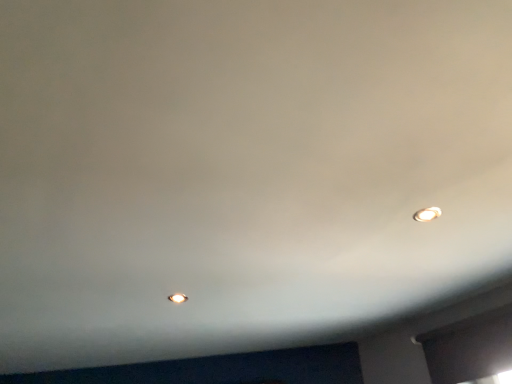
Question: From a real-world perspective, is matte white light bulb at upper right, the 1th light bulb positioned from the top, under transparent glass window at lower right?

Choices:
 (A) yes
 (B) no

Answer: (B)

Question: Is matte white light bulb at upper right, marked as the 2th light bulb in a back-to-front arrangement, wider than transparent glass window at lower right?

Choices:
 (A) no
 (B) yes

Answer: (B)

Question: Is matte white light bulb at upper right, which is the 2th light bulb in left-to-right order, facing towards transparent glass window at lower right?

Choices:
 (A) yes
 (B) no

Answer: (B)

Question: Is matte white light bulb at upper right, the 1th light bulb positioned from the top, bigger than transparent glass window at lower right?

Choices:
 (A) no
 (B) yes

Answer: (A)

Question: Can you confirm if matte white light bulb at upper right, which is the first light bulb from right to left, is positioned to the left of transparent glass window at lower right?

Choices:
 (A) yes
 (B) no

Answer: (A)

Question: Do you think matte white light bulb at center, acting as the 2th light bulb starting from the top, is within matte white light bulb at upper right, arranged as the 1th light bulb when viewed from the front, or outside of it?

Choices:
 (A) outside
 (B) inside

Answer: (A)

Question: From the image's perspective, is matte white light bulb at center, which ranks as the first light bulb in left-to-right order, positioned above or below matte white light bulb at upper right, the 1th light bulb positioned from the top?

Choices:
 (A) above
 (B) below

Answer: (B)

Question: Considering the positions of matte white light bulb at center, the 1th light bulb positioned from the back, and matte white light bulb at upper right, marked as the 2th light bulb in a back-to-front arrangement, in the image, is matte white light bulb at center, the 1th light bulb positioned from the back, bigger or smaller than matte white light bulb at upper right, marked as the 2th light bulb in a back-to-front arrangement,?

Choices:
 (A) small
 (B) big

Answer: (A)

Question: In the image, is matte white light bulb at center, which ranks as the 2th light bulb in front-to-back order, on the left side or the right side of matte white light bulb at upper right, which is the first light bulb from right to left?

Choices:
 (A) left
 (B) right

Answer: (A)

Question: From a real-world perspective, is matte white light bulb at upper right, which is the first light bulb from right to left, physically located above or below matte white light bulb at center, which appears as the first light bulb when ordered from the bottom?

Choices:
 (A) above
 (B) below

Answer: (A)

Question: Considering the relative positions of matte white light bulb at upper right, which is the 2th light bulb in left-to-right order, and matte white light bulb at center, which is the second light bulb in right-to-left order, in the image provided, is matte white light bulb at upper right, which is the 2th light bulb in left-to-right order, to the left or to the right of matte white light bulb at center, which is the second light bulb in right-to-left order,?

Choices:
 (A) left
 (B) right

Answer: (B)

Question: Looking at their shapes, would you say matte white light bulb at upper right, arranged as the 1th light bulb when viewed from the front, is wider or thinner than matte white light bulb at center, which ranks as the 2th light bulb in front-to-back order?

Choices:
 (A) wide
 (B) thin

Answer: (A)

Question: Is matte white light bulb at upper right, which is the 2th light bulb in left-to-right order, in front of or behind matte white light bulb at center, which ranks as the 2th light bulb in front-to-back order, in the image?

Choices:
 (A) front
 (B) behind

Answer: (A)

Question: In the image, is transparent glass window at lower right positioned in front of or behind matte white light bulb at upper right, which is the first light bulb from right to left?

Choices:
 (A) front
 (B) behind

Answer: (B)

Question: Looking at their shapes, would you say transparent glass window at lower right is wider or thinner than matte white light bulb at upper right, which appears as the second light bulb when ordered from the bottom?

Choices:
 (A) wide
 (B) thin

Answer: (B)